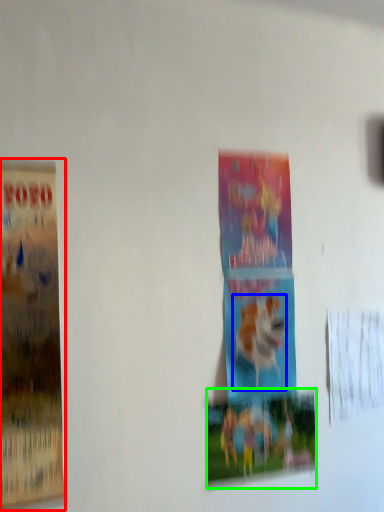
Question: Which object is positioned farthest from poster (highlighted by a red box)? Select from animal (highlighted by a blue box) and poster (highlighted by a green box).

Choices:
 (A) animal
 (B) poster

Answer: (A)